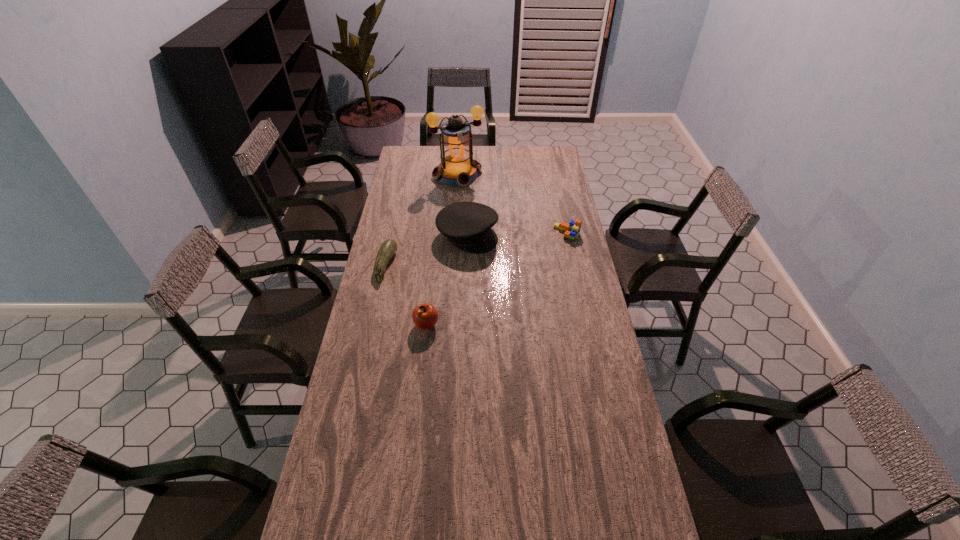
The width and height of the screenshot is (960, 540). I want to click on object that can be found as the fourth closest to the farthest object, so click(x=424, y=316).

The height and width of the screenshot is (540, 960). Find the location of `vacant space that satisfies the following two spatial constraints: 1. on the back side of the beret; 2. on the left side of the nearest object`. vacant space that satisfies the following two spatial constraints: 1. on the back side of the beret; 2. on the left side of the nearest object is located at coordinates (436, 235).

Identify the location of blank space that satisfies the following two spatial constraints: 1. on the back side of the Lego; 2. on the left side of the apple. Image resolution: width=960 pixels, height=540 pixels. pyautogui.click(x=436, y=233).

Where is `vacant space that satisfies the following two spatial constraints: 1. on the back side of the nearest object; 2. on the right side of the beret`? The image size is (960, 540). vacant space that satisfies the following two spatial constraints: 1. on the back side of the nearest object; 2. on the right side of the beret is located at coordinates (436, 235).

At what (x,y) coordinates should I click in order to perform the action: click on free space that satisfies the following two spatial constraints: 1. on the back side of the tallest object; 2. on the right side of the apple. Please return your answer as a coordinate pair (x, y). This screenshot has width=960, height=540. Looking at the image, I should click on (443, 174).